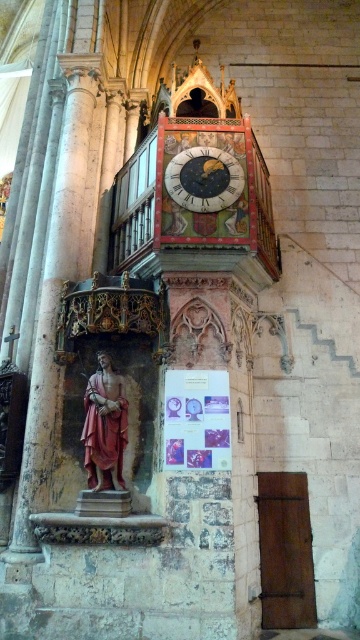
Between white marble column at left and matte pink statue at center, which one is positioned higher?

Positioned higher is white marble column at left.

Does white marble column at left appear on the right side of matte pink statue at center?

Incorrect, white marble column at left is not on the right side of matte pink statue at center.

This screenshot has width=360, height=640. What do you see at coordinates (54, 301) in the screenshot?
I see `white marble column at left` at bounding box center [54, 301].

What are the coordinates of `white marble column at left` in the screenshot? It's located at coord(54,301).

Does white marble column at left have a larger size compared to gold textured clock at center?

Correct, white marble column at left is larger in size than gold textured clock at center.

Who is more forward, [72,208] or [206,156]?

Point [206,156] is in front.

Image resolution: width=360 pixels, height=640 pixels. Identify the location of white marble column at left. (54, 301).

Between point (92, 413) and point (186, 150), which one is positioned in front?

Point (92, 413) is more forward.

Between matte pink statue at center and gold textured clock at center, which one has less height?

gold textured clock at center

Is point (101, 372) less distant than point (208, 161)?

Yes.

Locate an element on the screen. Image resolution: width=360 pixels, height=640 pixels. matte pink statue at center is located at coordinates (105, 426).